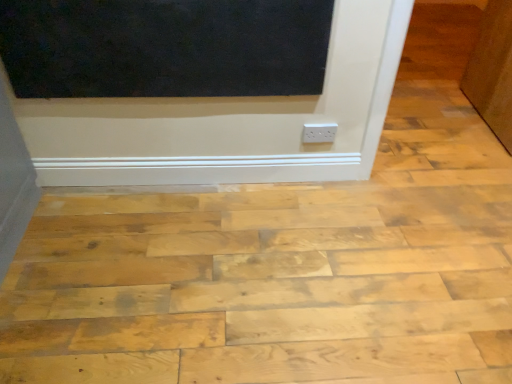
Question: Is brown matte door at upper right bigger or smaller than white plastic outlet at center?

Choices:
 (A) big
 (B) small

Answer: (A)

Question: Do you think brown matte door at upper right is within white plastic outlet at center, or outside of it?

Choices:
 (A) inside
 (B) outside

Answer: (B)

Question: Based on their relative distances, which object is farther from the matte black screen door at upper center?

Choices:
 (A) natural wood plywood at center
 (B) white plastic outlet at center
 (C) brown matte door at upper right

Answer: (C)

Question: Considering the real-world distances, which object is farthest from the white plastic outlet at center?

Choices:
 (A) natural wood plywood at center
 (B) brown matte door at upper right
 (C) matte black screen door at upper center

Answer: (B)